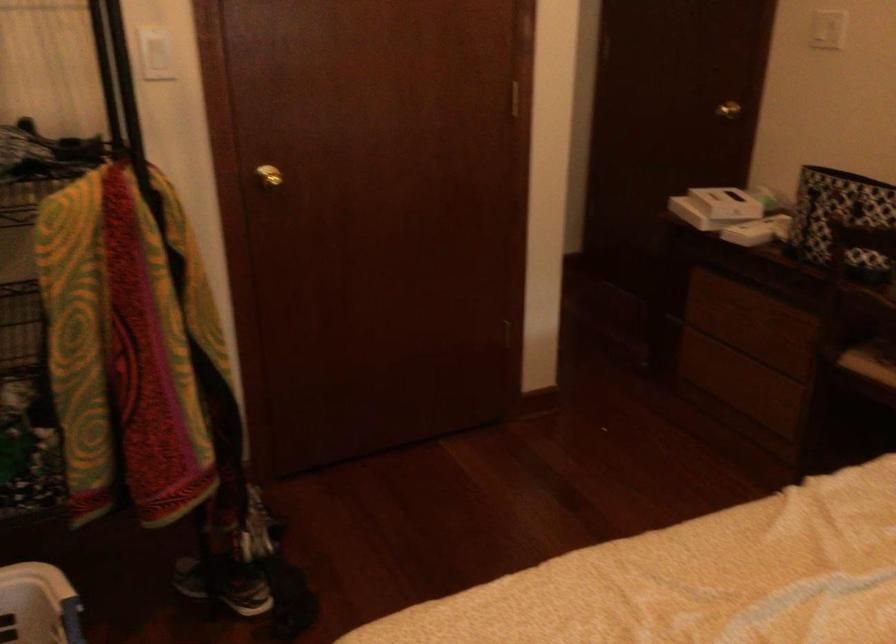
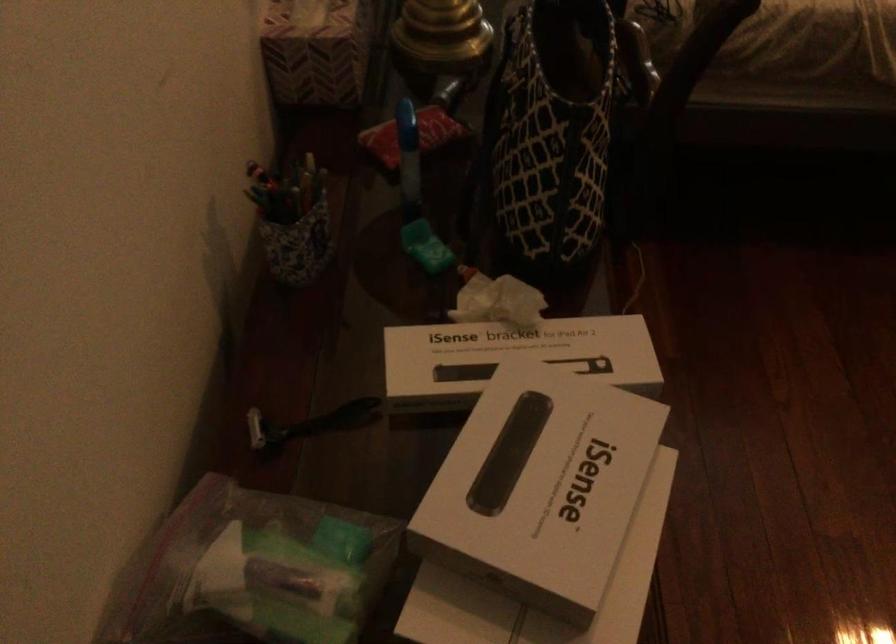
The point at (739, 182) is marked in the first image. Where is the corresponding point in the second image?

(252, 571)